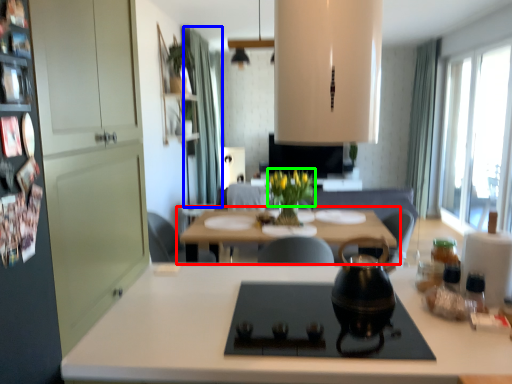
Question: Based on their relative distances, which object is farther from table (highlighted by a red box)? Choose from curtain (highlighted by a blue box) and flower (highlighted by a green box).

Choices:
 (A) curtain
 (B) flower

Answer: (A)